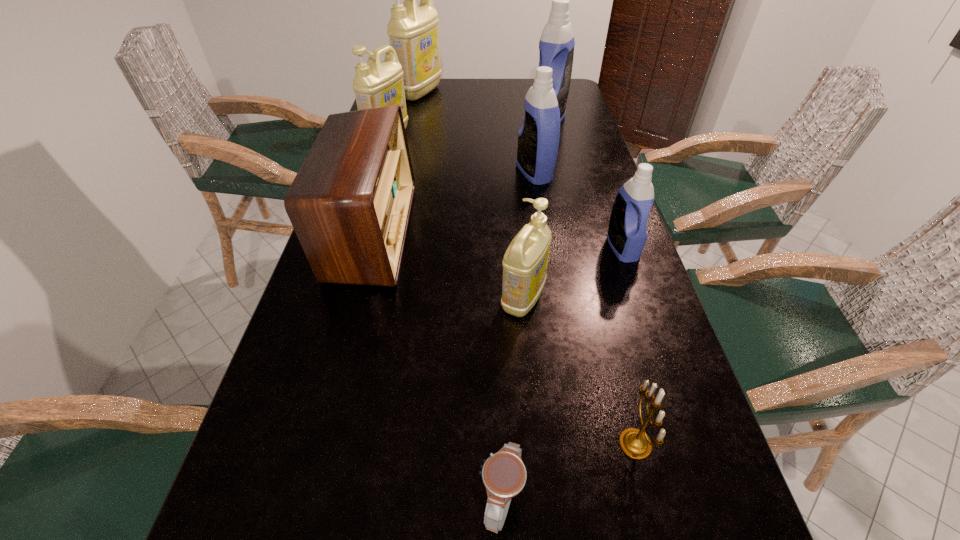
The image size is (960, 540). In order to click on free space located 0.210m on the left of the gold candelabrum in this screenshot , I will do `click(491, 443)`.

The width and height of the screenshot is (960, 540). Identify the location of object that is at the far edge. (413, 31).

Locate an element on the screen. This screenshot has width=960, height=540. radio receiver that is positioned at the left edge is located at coordinates (350, 203).

The width and height of the screenshot is (960, 540). Find the location of `candelabrum present at the right edge`. candelabrum present at the right edge is located at coordinates (634, 442).

Find the location of `object located in the far left corner section of the desktop`. object located in the far left corner section of the desktop is located at coordinates (413, 31).

The width and height of the screenshot is (960, 540). I want to click on vacant space at the left edge, so click(x=336, y=286).

You are a GUI agent. You are given a task and a screenshot of the screen. Output one action in this format:
    pyautogui.click(x=<x>, y=<y>)
    Task: Click on the vacant region at the right edge
    Image resolution: width=960 pixels, height=540 pixels.
    Given the screenshot: What is the action you would take?
    pyautogui.click(x=595, y=181)

I want to click on free space at the far right corner of the desktop, so click(x=576, y=97).

At what (x,y) coordinates should I click in order to perform the action: click on free spot between the second biggest beige detergent and the fifth farthest detergent. Please return your answer as a coordinate pair (x, y). Image resolution: width=960 pixels, height=540 pixels. Looking at the image, I should click on (505, 193).

At what (x,y) coordinates should I click in order to perform the action: click on free space between the nearest blue detergent and the gold candelabrum. Please return your answer as a coordinate pair (x, y). This screenshot has height=540, width=960. Looking at the image, I should click on (629, 346).